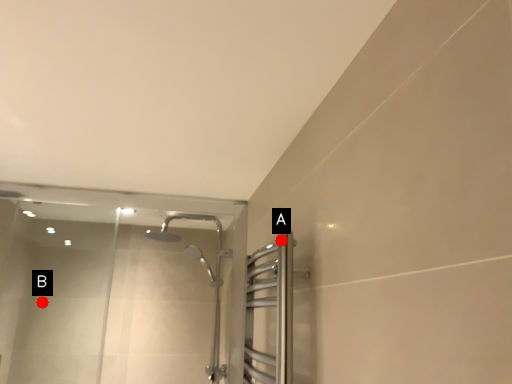
Question: Two points are circled on the image, labeled by A and B beside each circle. Which point appears farthest from the camera in this image?

Choices:
 (A) A is further
 (B) B is further

Answer: (B)